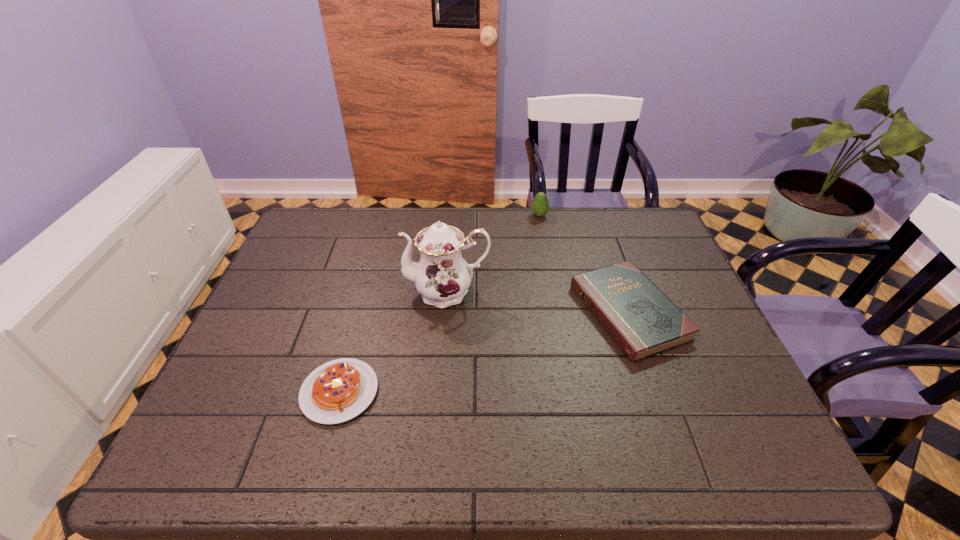
This screenshot has width=960, height=540. I want to click on free point located on the back of the leftmost object, so click(x=377, y=254).

Identify the location of object present at the far edge. (540, 205).

In order to click on object that is positioned at the right edge in this screenshot , I will do `click(638, 316)`.

The image size is (960, 540). In the image, there is a desktop. Identify the location of free space at the far edge. (x=401, y=236).

This screenshot has width=960, height=540. I want to click on vacant area at the near edge of the desktop, so click(369, 438).

This screenshot has width=960, height=540. In order to click on free space at the left edge in this screenshot , I will do `click(277, 320)`.

Where is `free space at the right edge of the desktop`? free space at the right edge of the desktop is located at coordinates (636, 255).

In the image, there is a desktop. Where is `vacant area at the far left corner`? This screenshot has height=540, width=960. vacant area at the far left corner is located at coordinates (318, 239).

Where is `vacant point located between the farthest object and the third object from right to left`? Image resolution: width=960 pixels, height=540 pixels. vacant point located between the farthest object and the third object from right to left is located at coordinates (493, 253).

Find the location of a particular element. This screenshot has width=960, height=540. vacant space that's between the chinaware and the pancake is located at coordinates (394, 342).